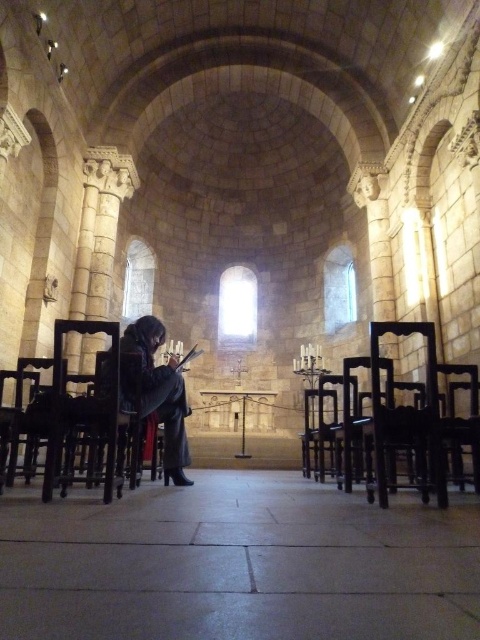
You are standing at the entrance of the historic church or cathedral and need to reach the smooth stone floor at center. According to the image, where should you walk to find it?

The smooth stone floor at center is located at coordinates point (238,564), so you should walk towards the center of the image to reach it.